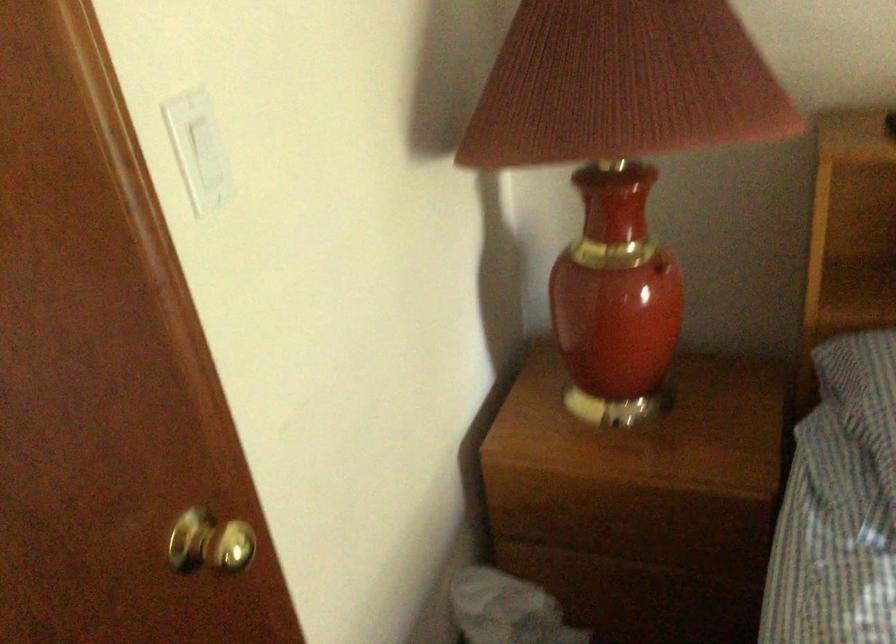
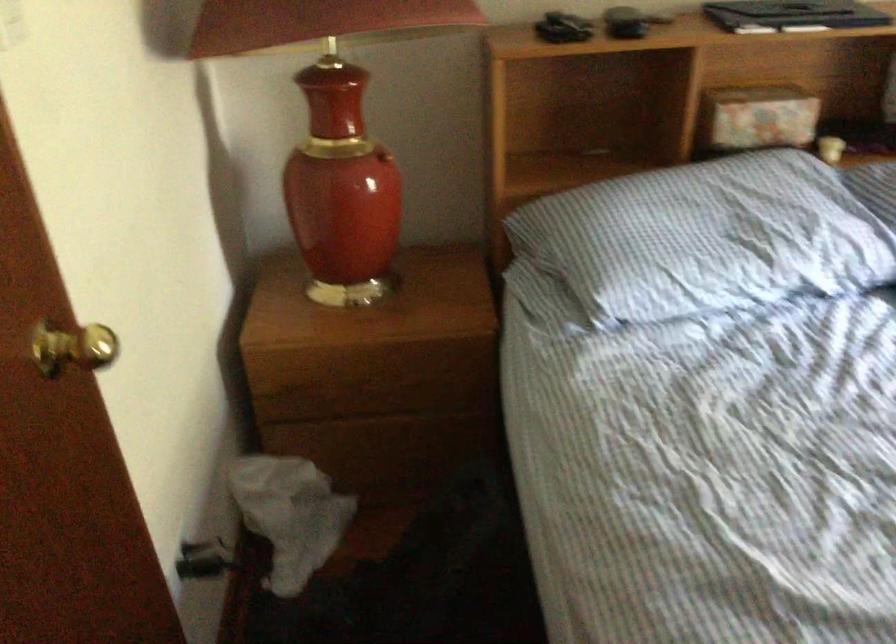
Question: The camera is either moving clockwise (left) or counter-clockwise (right) around the object. The first image is from the beginning of the video and the second image is from the end. Is the camera moving left or right when shooting the video?

Choices:
 (A) Left
 (B) Right

Answer: (A)